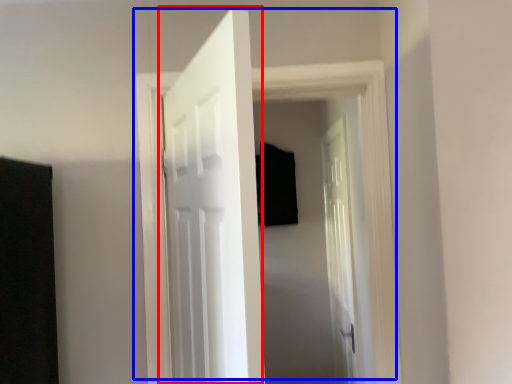
Question: Among these objects, which one is nearest to the camera, door (highlighted by a red box) or door (highlighted by a blue box)?

Choices:
 (A) door
 (B) door

Answer: (A)